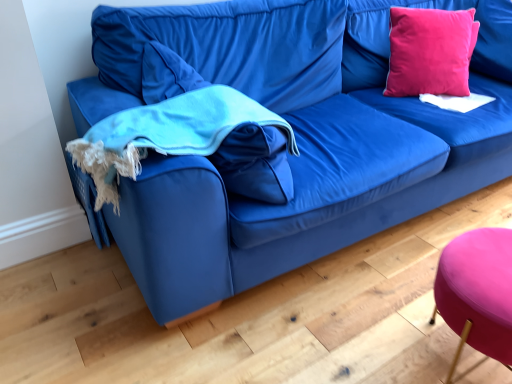
Question: Considering the relative sizes of turquoise fleece blanket at left and purple fabric stool at lower right in the image provided, is turquoise fleece blanket at left smaller than purple fabric stool at lower right?

Choices:
 (A) yes
 (B) no

Answer: (B)

Question: From the image's perspective, is turquoise fleece blanket at left on purple fabric stool at lower right?

Choices:
 (A) yes
 (B) no

Answer: (A)

Question: Does turquoise fleece blanket at left contain purple fabric stool at lower right?

Choices:
 (A) yes
 (B) no

Answer: (B)

Question: Is turquoise fleece blanket at left facing away from purple fabric stool at lower right?

Choices:
 (A) yes
 (B) no

Answer: (B)

Question: Is turquoise fleece blanket at left taller than purple fabric stool at lower right?

Choices:
 (A) no
 (B) yes

Answer: (A)

Question: From the image's perspective, is turquoise fleece blanket at left positioned above or below purple fabric stool at lower right?

Choices:
 (A) above
 (B) below

Answer: (A)

Question: Is turquoise fleece blanket at left inside or outside of purple fabric stool at lower right?

Choices:
 (A) inside
 (B) outside

Answer: (B)

Question: Is turquoise fleece blanket at left taller or shorter than purple fabric stool at lower right?

Choices:
 (A) short
 (B) tall

Answer: (A)

Question: In terms of size, does turquoise fleece blanket at left appear bigger or smaller than purple fabric stool at lower right?

Choices:
 (A) small
 (B) big

Answer: (B)

Question: Relative to turquoise fleece blanket at left, is purple fabric stool at lower right in front or behind?

Choices:
 (A) front
 (B) behind

Answer: (A)

Question: From a real-world perspective, is purple fabric stool at lower right physically located above or below turquoise fleece blanket at left?

Choices:
 (A) above
 (B) below

Answer: (B)

Question: In terms of width, does purple fabric stool at lower right look wider or thinner when compared to turquoise fleece blanket at left?

Choices:
 (A) thin
 (B) wide

Answer: (A)

Question: From the image's perspective, is purple fabric stool at lower right located above or below turquoise fleece blanket at left?

Choices:
 (A) below
 (B) above

Answer: (A)

Question: In the image, is turquoise fleece blanket at left positioned in front of or behind pink velvet pillow at upper right?

Choices:
 (A) behind
 (B) front

Answer: (B)

Question: In terms of width, does turquoise fleece blanket at left look wider or thinner when compared to pink velvet pillow at upper right?

Choices:
 (A) thin
 (B) wide

Answer: (B)